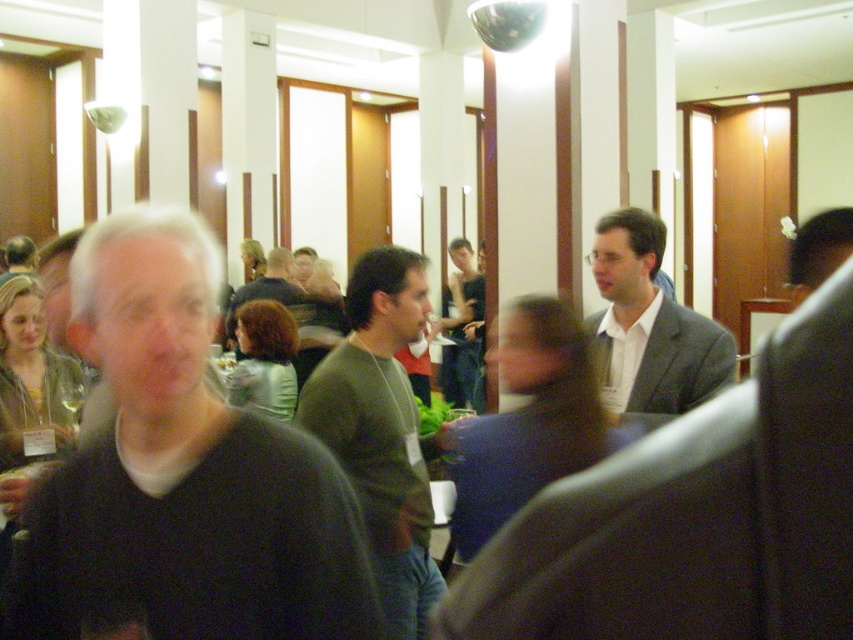
You are attending a professional event and need to discreetly pass a note to someone sitting behind you. You notice the green matte sweater at center and the light gray suit at center. Which person should you target to ensure your note reaches the person behind you without being seen?

You should target the light gray suit at center because the green matte sweater at center is closer to the viewer, meaning the light gray suit at center is further back and thus the note can be passed discreetly to the person behind them.

You are a photographer at the event and need to capture a photo of both the green matte sweater at center and the light gray suit at center. Based on their positions, which one should you focus on first to ensure both are in the frame?

The green matte sweater at center is located below the light gray suit at center, so you should focus on the light gray suit at center first to ensure both are in the frame.

You are organizing a photo shoot and need to ensure proper lighting for the subjects. The white shirt at center and light gray suit at center are both in the frame. Which subject should you adjust the lighting for first based on their position?

The white shirt at center should be adjusted first because it is positioned under the light gray suit at center, meaning it might be in a shadowed area requiring more light.